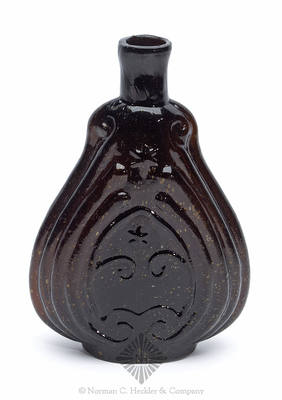
Locate an element on the screen. This screenshot has width=282, height=400. bottle is located at coordinates (148, 300).